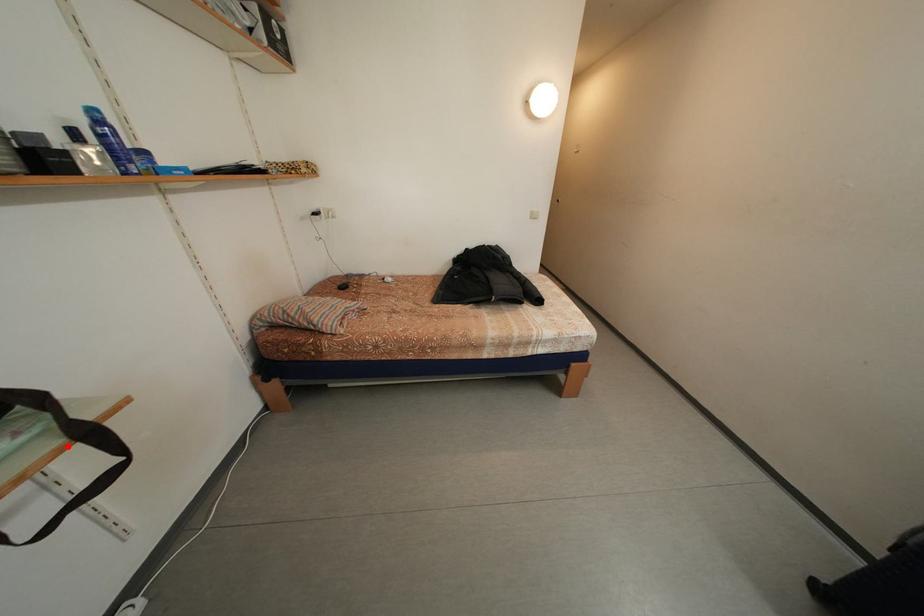
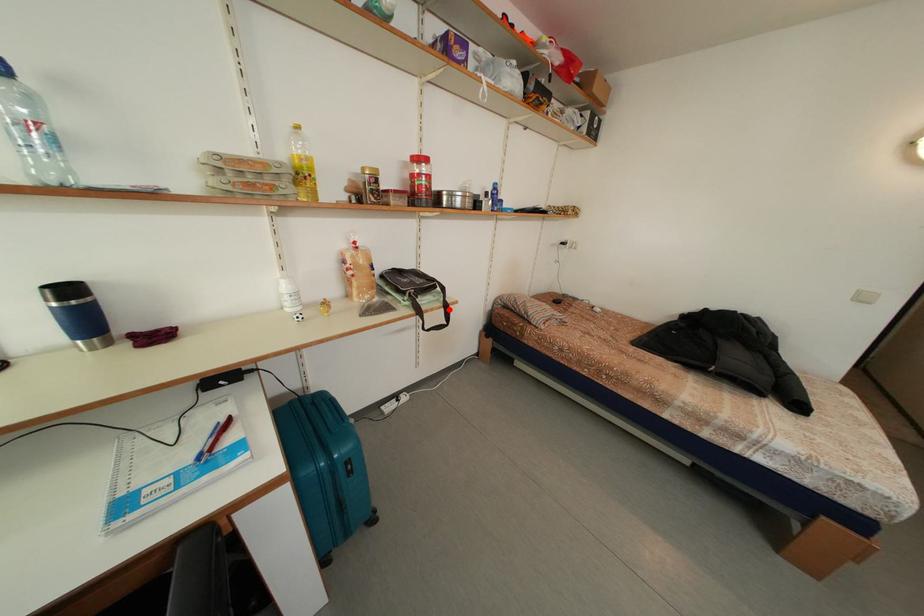
I am providing you with two images of the same scene from different viewpoints. A red point is marked on the first image and another point is marked on the second image. Is the red point in image1 aligned with the point shown in image2?

Yes